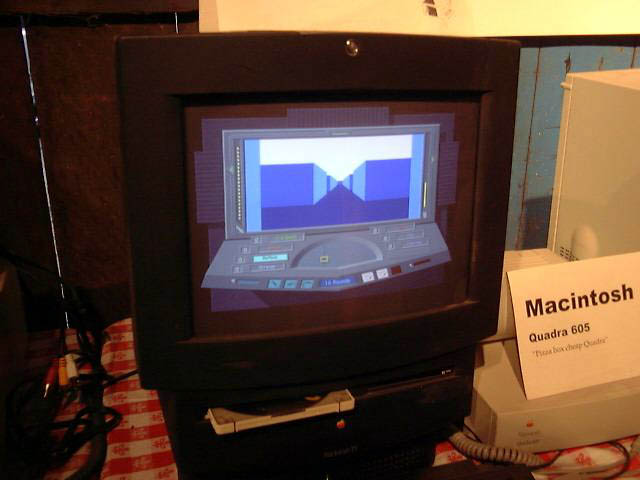
Identify the location of telephone cord. The height and width of the screenshot is (480, 640). (490, 456).